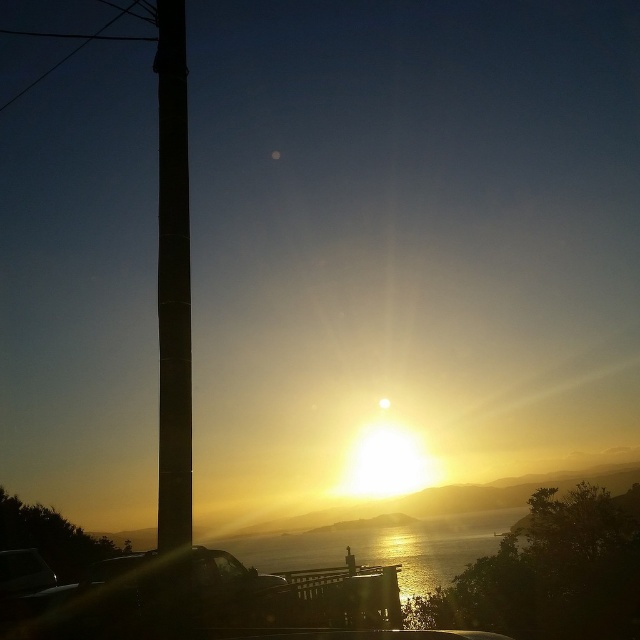
This screenshot has height=640, width=640. What do you see at coordinates (145, 598) in the screenshot? I see `shiny black car at lower left` at bounding box center [145, 598].

Is point (218, 609) positioned behind point (301, 564)?

No, it is in front of (301, 564).

Between point (100, 572) and point (324, 536), which one is positioned behind?

Point (324, 536)

At what (x,y) coordinates should I click in order to perform the action: click on shiny black car at lower left. Please return your answer as a coordinate pair (x, y). The width and height of the screenshot is (640, 640). Looking at the image, I should click on (145, 598).

Is shiny black car at lower left positioned at the back of black smooth pole at left?

No, shiny black car at lower left is closer to the viewer.

Which is behind, point (76, 618) or point (164, 282)?

The point (76, 618) is more distant.

Where is `shiny black car at lower left`? The image size is (640, 640). shiny black car at lower left is located at coordinates (145, 598).

Looking at this image, can you confirm if shiny black car at lower left is bigger than transparent glass car window at lower center?

Indeed, shiny black car at lower left has a larger size compared to transparent glass car window at lower center.

Looking at this image, is shiny black car at lower left below transparent glass car window at lower center?

No.

Between point (67, 634) and point (228, 570), which one is positioned in front?

Point (67, 634) is more forward.

In order to click on shiny black car at lower left in this screenshot , I will do `click(145, 598)`.